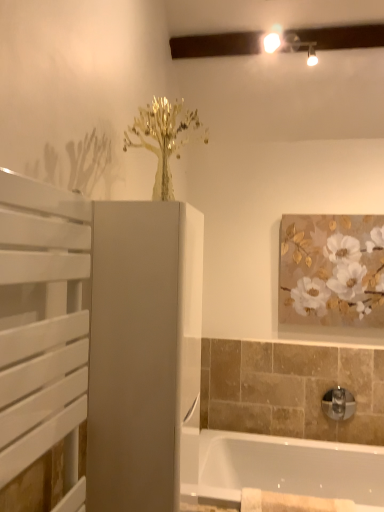
Question: Considering the relative positions of chrome metallic tap at lower right and white glossy bathtub at lower right in the image provided, is chrome metallic tap at lower right to the right of white glossy bathtub at lower right from the viewer's perspective?

Choices:
 (A) yes
 (B) no

Answer: (A)

Question: Is chrome metallic tap at lower right surrounding white glossy bathtub at lower right?

Choices:
 (A) no
 (B) yes

Answer: (A)

Question: Is chrome metallic tap at lower right closer to camera compared to white glossy bathtub at lower right?

Choices:
 (A) no
 (B) yes

Answer: (A)

Question: Can you confirm if chrome metallic tap at lower right is smaller than white glossy bathtub at lower right?

Choices:
 (A) no
 (B) yes

Answer: (B)

Question: From a real-world perspective, is chrome metallic tap at lower right physically below white glossy bathtub at lower right?

Choices:
 (A) no
 (B) yes

Answer: (A)

Question: Could you tell me if chrome metallic tap at lower right is turned towards white glossy bathtub at lower right?

Choices:
 (A) no
 (B) yes

Answer: (A)

Question: Is gold textured painting at upper right wider than white glossy bathtub at lower right?

Choices:
 (A) yes
 (B) no

Answer: (B)

Question: From a real-world perspective, is gold textured painting at upper right located beneath white glossy bathtub at lower right?

Choices:
 (A) no
 (B) yes

Answer: (A)

Question: From a real-world perspective, is gold textured painting at upper right on top of white glossy bathtub at lower right?

Choices:
 (A) no
 (B) yes

Answer: (B)

Question: Can you confirm if gold textured painting at upper right is thinner than white glossy bathtub at lower right?

Choices:
 (A) yes
 (B) no

Answer: (A)

Question: Is gold textured painting at upper right to the left of white glossy bathtub at lower right from the viewer's perspective?

Choices:
 (A) no
 (B) yes

Answer: (A)

Question: From the image's perspective, is gold textured painting at upper right under white glossy bathtub at lower right?

Choices:
 (A) no
 (B) yes

Answer: (A)

Question: Considering the relative sizes of white slatted screen door at left, which appears as the 1th screen door when viewed from the front, and matte white cabinet at center, the 2th screen door viewed from the front, in the image provided, is white slatted screen door at left, which appears as the 1th screen door when viewed from the front, thinner than matte white cabinet at center, the 2th screen door viewed from the front,?

Choices:
 (A) yes
 (B) no

Answer: (A)